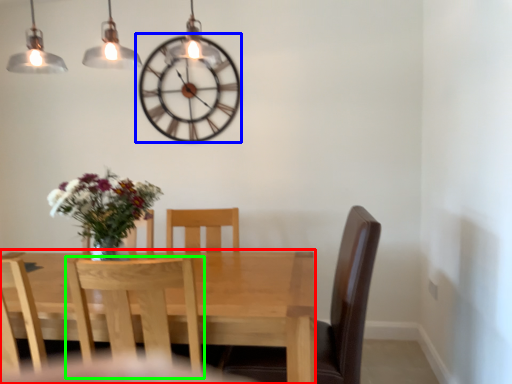
Question: Considering the real-world distances, which object is farthest from kitchen & dining room table (highlighted by a red box)? wall clock (highlighted by a blue box) or chair (highlighted by a green box)?

Choices:
 (A) wall clock
 (B) chair

Answer: (A)